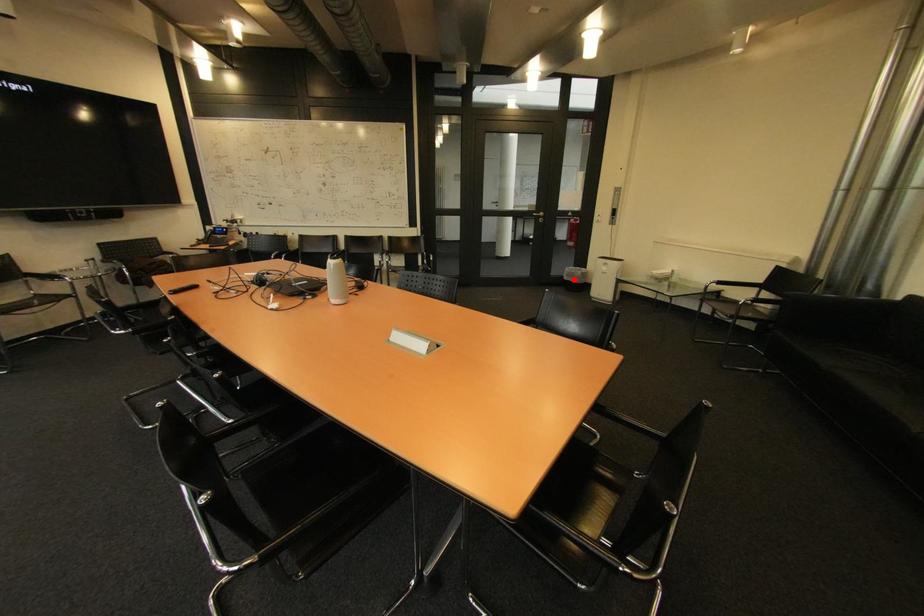
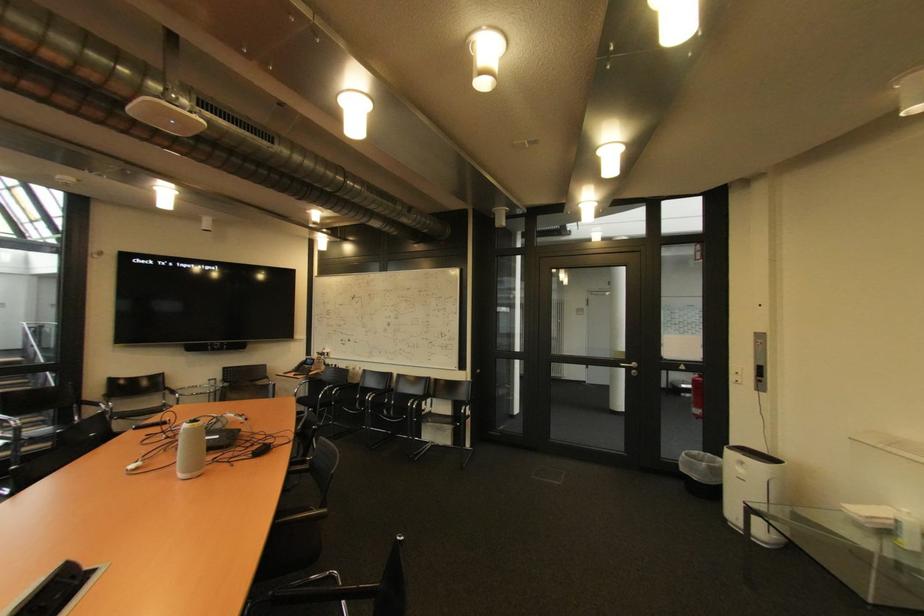
The point at the highlighted location is marked in the first image. Where is the corresponding point in the second image?

(690, 471)